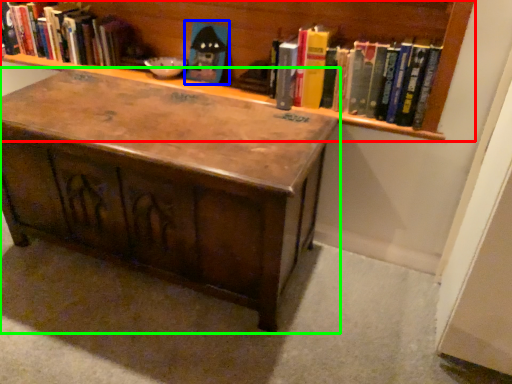
Question: Which is nearer to the bookcase (highlighted by a red box)? toy (highlighted by a blue box) or table (highlighted by a green box).

Choices:
 (A) toy
 (B) table

Answer: (A)